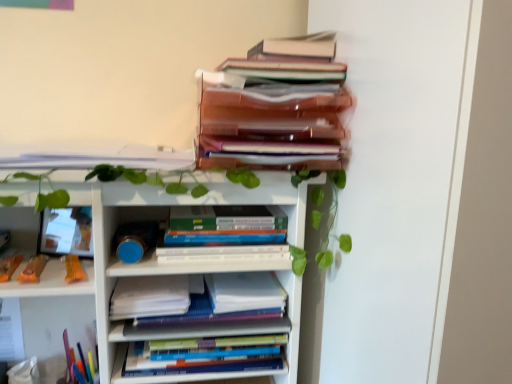
Question: Can you confirm if white paper at center, the second paperback book in the right-to-left sequence, is positioned to the right of white paper at center, which appears as the 1th paperback book when viewed from the right?

Choices:
 (A) yes
 (B) no

Answer: (B)

Question: Is white paper at center, the first paperback book viewed from the left, further to camera compared to white paper at center, which appears as the 1th paperback book when viewed from the right?

Choices:
 (A) yes
 (B) no

Answer: (B)

Question: From a real-world perspective, is white paper at center, the first paperback book viewed from the left, located beneath white paper at center, which ranks as the second paperback book in left-to-right order?

Choices:
 (A) yes
 (B) no

Answer: (B)

Question: Is white paper at center, the second paperback book in the right-to-left sequence, facing away from white paper at center, which appears as the 1th paperback book when viewed from the right?

Choices:
 (A) yes
 (B) no

Answer: (B)

Question: Is white paper at center, the first paperback book viewed from the left, at the left side of white paper at center, which appears as the 1th paperback book when viewed from the right?

Choices:
 (A) no
 (B) yes

Answer: (B)

Question: In the image, is hardcover books at center, positioned as the 3th book in bottom-to-top order, on the left side or the right side of hardcover books at center, which appears as the first book when ordered from the bottom?

Choices:
 (A) left
 (B) right

Answer: (B)

Question: From the image's perspective, is hardcover books at center, positioned as the 3th book in bottom-to-top order, above or below hardcover books at center, which ranks as the 5th book in top-to-bottom order?

Choices:
 (A) below
 (B) above

Answer: (B)

Question: From a real-world perspective, is hardcover books at center, positioned as the 3th book in bottom-to-top order, positioned above or below hardcover books at center, which appears as the first book when ordered from the bottom?

Choices:
 (A) below
 (B) above

Answer: (B)

Question: Is hardcover books at center, the 3th book in the top-to-bottom sequence, spatially inside hardcover books at center, which ranks as the 5th book in top-to-bottom order, or outside of it?

Choices:
 (A) inside
 (B) outside

Answer: (B)

Question: From the image's perspective, relative to white paper at center, the first paperback book viewed from the left, is white paper at center, the fourth book from the top, above or below?

Choices:
 (A) below
 (B) above

Answer: (A)

Question: Considering the relative positions of white paper at center, the fourth book from the top, and white paper at center, the first paperback book viewed from the left, in the image provided, is white paper at center, the fourth book from the top, to the left or to the right of white paper at center, the first paperback book viewed from the left,?

Choices:
 (A) left
 (B) right

Answer: (B)

Question: Considering the positions of point (200, 327) and point (114, 301), is point (200, 327) closer or farther from the camera than point (114, 301)?

Choices:
 (A) farther
 (B) closer

Answer: (A)

Question: In terms of height, does white paper at center, arranged as the second book when ordered from the bottom, look taller or shorter compared to white paper at center, the first paperback book viewed from the left?

Choices:
 (A) short
 (B) tall

Answer: (A)

Question: From the image's perspective, relative to white paper at center, the first paperback book viewed from the left, is hardcover books at center, positioned as the 3th book in bottom-to-top order, above or below?

Choices:
 (A) above
 (B) below

Answer: (A)

Question: Looking at their shapes, would you say hardcover books at center, the 3th book in the top-to-bottom sequence, is wider or thinner than white paper at center, the second paperback book in the right-to-left sequence?

Choices:
 (A) wide
 (B) thin

Answer: (B)